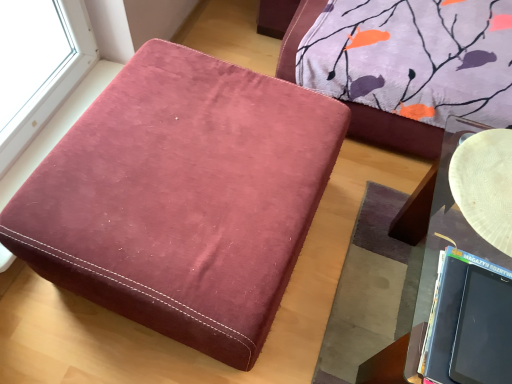
Locate an element on the screen. The height and width of the screenshot is (384, 512). vacant area that is situated to the right of velvet-like burgundy ottoman at center is located at coordinates (353, 248).